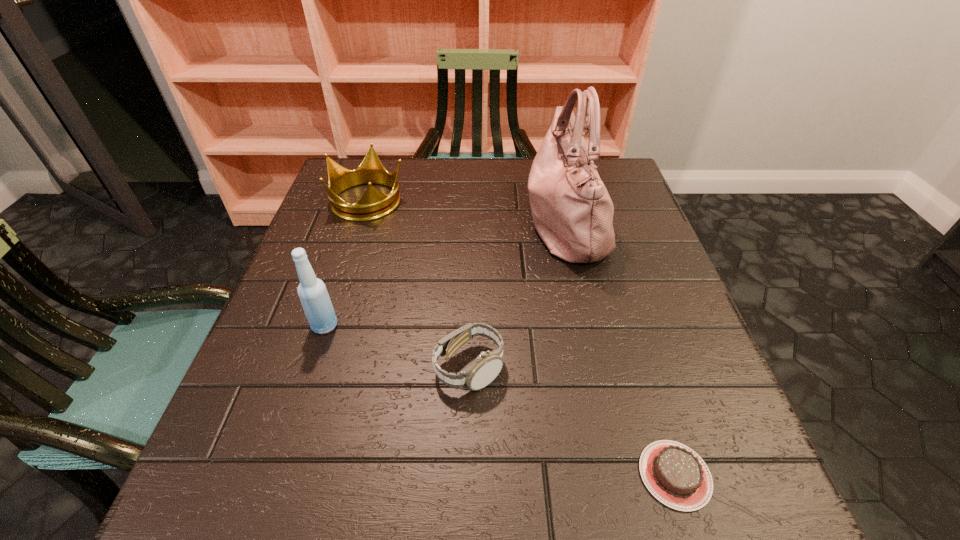
Find the location of a particular element. This screenshot has width=960, height=540. blank area located 0.270m at the front of the tallest object with handles is located at coordinates (414, 222).

Identify the location of free space located on the back of the second tallest object. This screenshot has width=960, height=540. (335, 294).

Where is `vacant space located 0.270m on the front of the third shortest object`? The width and height of the screenshot is (960, 540). vacant space located 0.270m on the front of the third shortest object is located at coordinates (334, 305).

Where is `free spot located on the face of the fourth tallest object`? This screenshot has width=960, height=540. free spot located on the face of the fourth tallest object is located at coordinates (548, 368).

At what (x,y) coordinates should I click in order to perform the action: click on free space located 0.110m on the back of the shortest object. Please return your answer as a coordinate pair (x, y). This screenshot has width=960, height=540. Looking at the image, I should click on (645, 379).

Locate an element on the screen. The width and height of the screenshot is (960, 540). handbag situated at the far edge is located at coordinates (572, 211).

Locate an element on the screen. crown positioned at the far edge is located at coordinates click(x=373, y=204).

You are a GUI agent. You are given a task and a screenshot of the screen. Output one action in this format:
    pyautogui.click(x=<x>, y=<y>)
    Task: Click on the object that is at the near edge
    This screenshot has width=960, height=540.
    Given the screenshot: What is the action you would take?
    [x=677, y=476]

Locate an element on the screen. The width and height of the screenshot is (960, 540). bottle at the left edge is located at coordinates (315, 300).

Where is `crown present at the left edge`? crown present at the left edge is located at coordinates (373, 204).